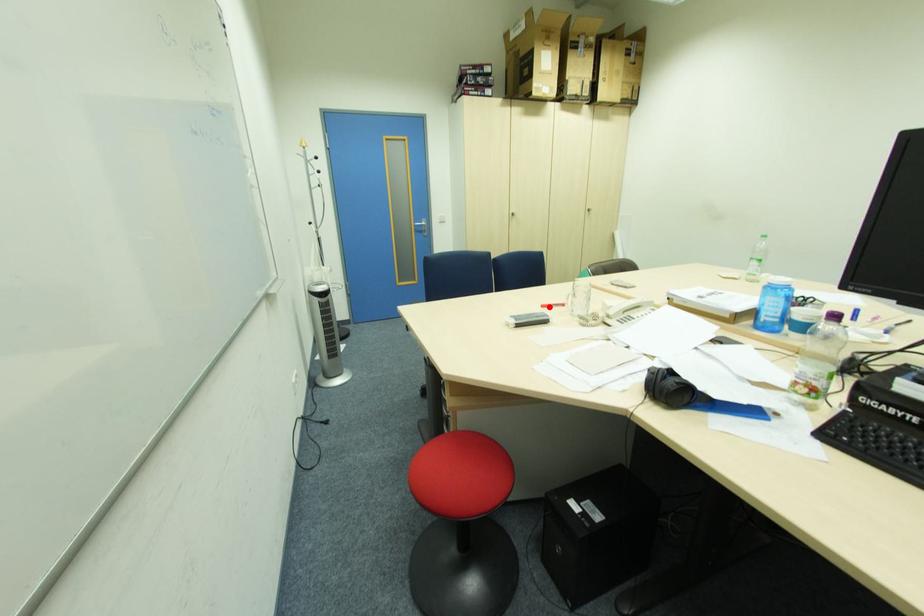
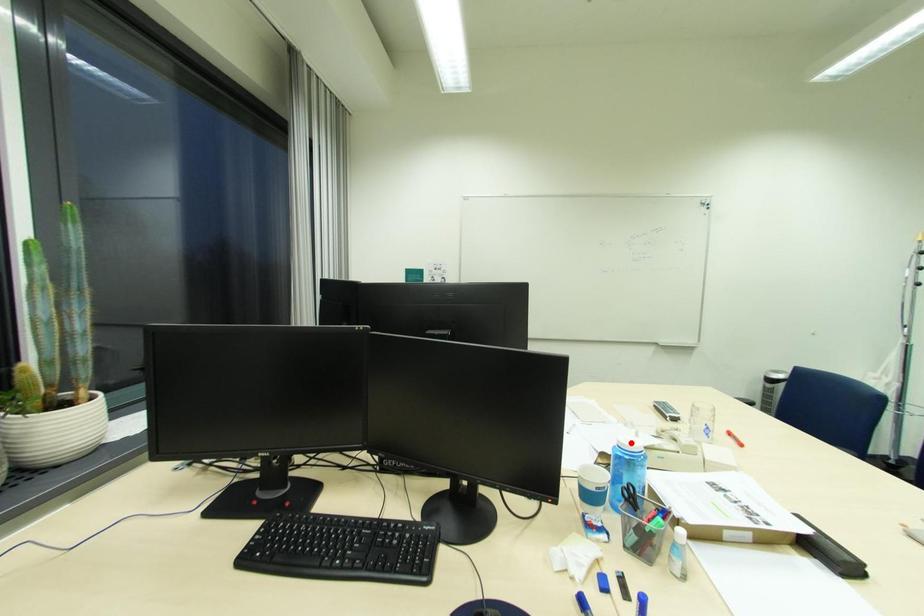
I am providing you with two images of the same scene from different viewpoints. A red point is marked on the first image and another point is marked on the second image. Do the highlighted points in image1 and image2 indicate the same real-world spot?

No